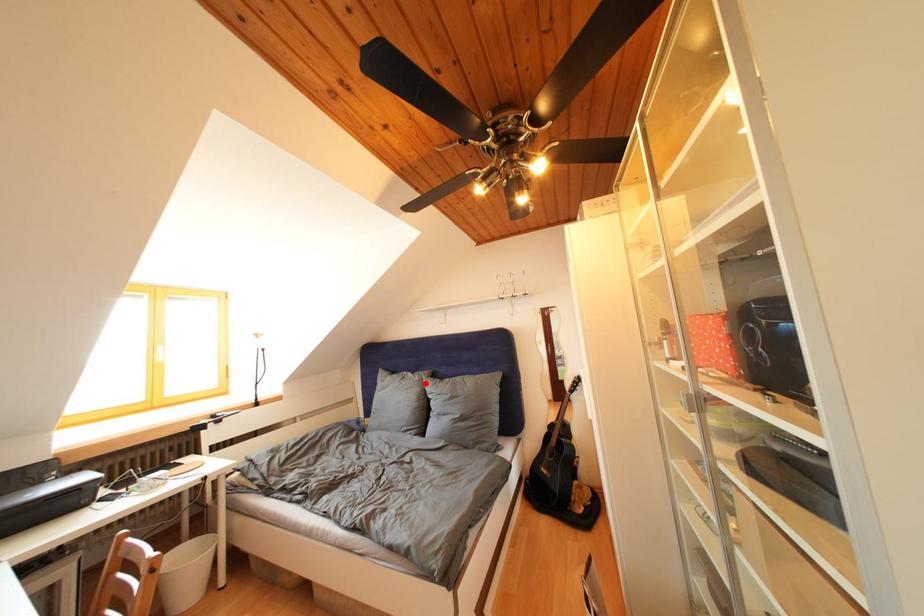
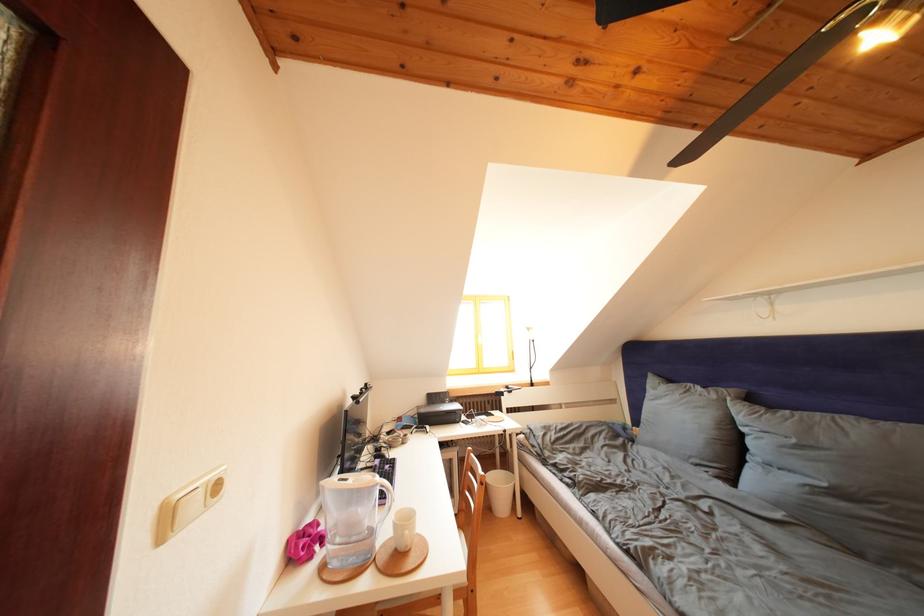
Find the pixel in the second image that matches the highlighted location in the first image.

(722, 402)